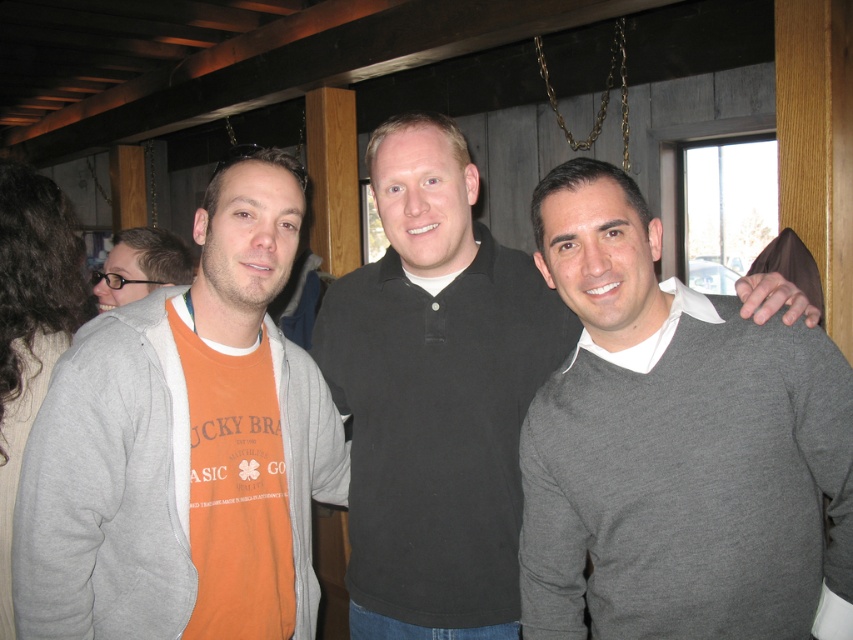
Which is behind, point (206, 634) or point (102, 294)?

Positioned behind is point (102, 294).

Does orange cotton t-shirt at left have a lesser width compared to matte orange t-shirt at left?

Incorrect, orange cotton t-shirt at left's width is not less than matte orange t-shirt at left's.

The height and width of the screenshot is (640, 853). Identify the location of orange cotton t-shirt at left. (184, 448).

This screenshot has height=640, width=853. Identify the location of orange cotton t-shirt at left. (184, 448).

Who is shorter, black smooth polo shirt at center or matte orange t-shirt at left?

Standing shorter between the two is matte orange t-shirt at left.

Who is lower down, black smooth polo shirt at center or matte orange t-shirt at left?

Positioned lower is black smooth polo shirt at center.

Between point (427, 548) and point (126, 268), which one is positioned behind?

The point (126, 268) is more distant.

At what (x,y) coordinates should I click in order to perform the action: click on black smooth polo shirt at center. Please return your answer as a coordinate pair (x, y). Looking at the image, I should click on (434, 392).

Who is shorter, orange cotton t-shirt at left or black smooth polo shirt at center?

With less height is orange cotton t-shirt at left.

Does orange cotton t-shirt at left have a lesser height compared to black smooth polo shirt at center?

Correct, orange cotton t-shirt at left is not as tall as black smooth polo shirt at center.

Describe the element at coordinates (184, 448) in the screenshot. This screenshot has width=853, height=640. I see `orange cotton t-shirt at left` at that location.

Locate an element on the screen. The height and width of the screenshot is (640, 853). orange cotton t-shirt at left is located at coordinates (184, 448).